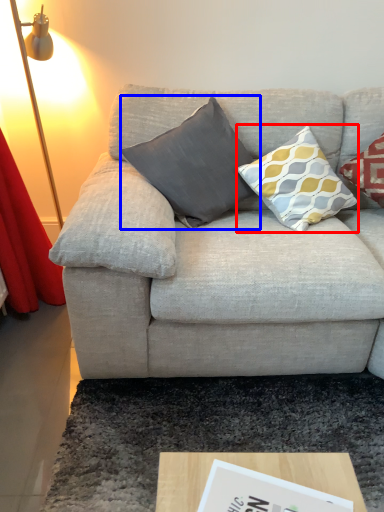
Question: Which object is closer to the camera taking this photo, pillow (highlighted by a red box) or pillow (highlighted by a blue box)?

Choices:
 (A) pillow
 (B) pillow

Answer: (A)